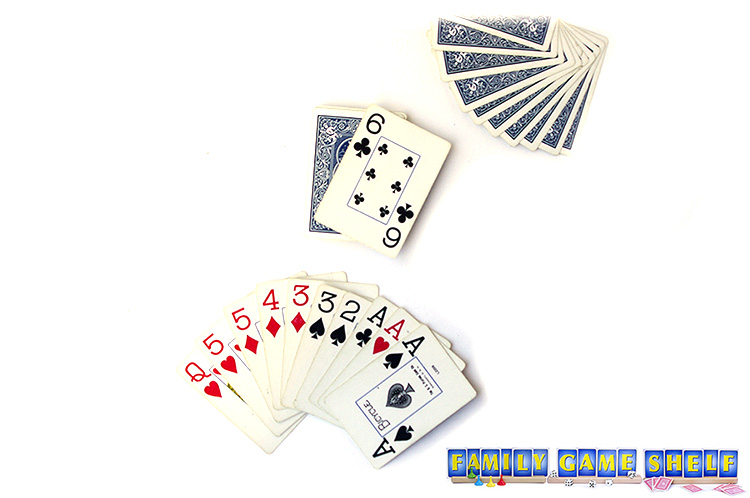
Identify the location of playing cards. (546, 88), (340, 156), (309, 321).